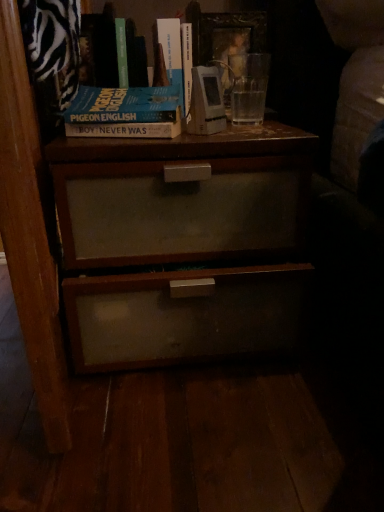
Question: Considering the positions of blue matte book at upper center and hardcover book at upper center, marked as the first book in a right-to-left arrangement, in the image, is blue matte book at upper center bigger or smaller than hardcover book at upper center, marked as the first book in a right-to-left arrangement,?

Choices:
 (A) big
 (B) small

Answer: (A)

Question: Considering the positions of blue matte book at upper center and hardcover book at upper center, the 2th book viewed from the left, in the image, is blue matte book at upper center taller or shorter than hardcover book at upper center, the 2th book viewed from the left,?

Choices:
 (A) short
 (B) tall

Answer: (A)

Question: Based on their relative distances, which object is nearer to the hardcover book at upper center, arranged as the 1th book when viewed from the left?

Choices:
 (A) matte wood nightstand at center
 (B) hardcover book at upper center, the 2th book viewed from the left
 (C) blue matte book at upper center

Answer: (B)

Question: Which object is the closest to the hardcover book at upper center, the 2th book viewed from the left?

Choices:
 (A) blue matte book at upper center
 (B) hardcover book at upper center, the second book when ordered from right to left
 (C) matte wood nightstand at center

Answer: (B)